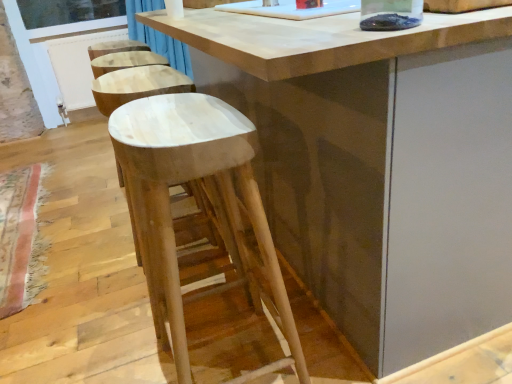
What do you see at coordinates (378, 165) in the screenshot?
I see `natural wood table at center` at bounding box center [378, 165].

The height and width of the screenshot is (384, 512). Identify the location of white plastic screen door at left. (63, 53).

You are a GUI agent. You are given a task and a screenshot of the screen. Output one action in this format:
    pyautogui.click(x=<x>, y=<y>)
    Task: Click on the natural wood table at center
    This screenshot has height=384, width=512.
    Given the screenshot: What is the action you would take?
    pyautogui.click(x=378, y=165)

Does natural wood stool at center have a smaller size compared to natural wood table at center?

Yes, natural wood stool at center is smaller than natural wood table at center.

Is natural wood stool at center turned away from natural wood table at center?

No.

Is natural wood table at center surrounded by natural wood stool at center?

Actually, natural wood table at center is outside natural wood stool at center.

Are natural wood stool at center and natural wood table at center located far from each other?

Actually, natural wood stool at center and natural wood table at center are a little close together.

From the image's perspective, between clear glass window screen at upper left and natural wood table at center, who is located below?

From the image's view, natural wood table at center is below.

Is clear glass window screen at upper left facing away from natural wood table at center?

clear glass window screen at upper left is not turned away from natural wood table at center.

Can you see clear glass window screen at upper left touching natural wood table at center?

No, clear glass window screen at upper left is not next to natural wood table at center.

How far apart are clear glass window screen at upper left and natural wood table at center?

10.25 feet.

Which is behind, point (33, 28) or point (26, 25)?

The point (26, 25) is farther from the camera.

Is clear glass window screen at upper left outside of white plastic screen door at left?

No, clear glass window screen at upper left is not entirely external to white plastic screen door at left.

Looking at their sizes, would you say clear glass window screen at upper left is wider or thinner than white plastic screen door at left?

clear glass window screen at upper left is thinner than white plastic screen door at left.

Is clear glass window screen at upper left looking in the opposite direction of white plastic screen door at left?

Yes, clear glass window screen at upper left's orientation is away from white plastic screen door at left.

From a real-world perspective, is natural wood table at center on white plastic screen door at left?

No, from a real-world perspective, natural wood table at center is not on top of white plastic screen door at left.

In the scene shown: Could you tell me if natural wood table at center is facing white plastic screen door at left?

No, natural wood table at center does not turn towards white plastic screen door at left.

In terms of size, does natural wood table at center appear bigger or smaller than white plastic screen door at left?

In the image, natural wood table at center appears to be larger than white plastic screen door at left.

Considering the sizes of objects natural wood table at center and white plastic screen door at left in the image provided, who is thinner, natural wood table at center or white plastic screen door at left?

white plastic screen door at left.

Could you tell me if natural wood stool at center is turned towards white plastic screen door at left?

No, natural wood stool at center is not oriented towards white plastic screen door at left.

Can we say natural wood stool at center lies outside white plastic screen door at left?

Yes, natural wood stool at center is outside of white plastic screen door at left.

This screenshot has height=384, width=512. I want to click on screen door located behind the natural wood stool at center, so click(x=63, y=53).

Can you confirm if natural wood stool at center is bigger than white plastic screen door at left?

Correct, natural wood stool at center is larger in size than white plastic screen door at left.

Is natural wood stool at center surrounded by white plastic screen door at left?

No, natural wood stool at center is not inside white plastic screen door at left.

From a real-world perspective, which object stands above the other?

white plastic screen door at left is physically above.

Considering their positions, is white plastic screen door at left located in front of or behind natural wood stool at center?

white plastic screen door at left is positioned farther from the viewer than natural wood stool at center.

Does white plastic screen door at left have a lesser width compared to natural wood stool at center?

Yes.

Considering their positions, is natural wood stool at center located in front of or behind clear glass window screen at upper left?

Visually, natural wood stool at center is located in front of clear glass window screen at upper left.

Which of these two, natural wood stool at center or clear glass window screen at upper left, stands shorter?

clear glass window screen at upper left is shorter.

Is natural wood stool at center wider than clear glass window screen at upper left?

Indeed, natural wood stool at center has a greater width compared to clear glass window screen at upper left.

From a real-world perspective, which object rests below the other?

natural wood stool at center is physically lower.

You are a GUI agent. You are given a task and a screenshot of the screen. Output one action in this format:
    pyautogui.click(x=<x>, y=<y>)
    Task: Click on the table behind the natural wood stool at center
    The image size is (512, 384).
    Given the screenshot: What is the action you would take?
    pyautogui.click(x=378, y=165)

At what (x,y) coordinates should I click in order to perform the action: click on table below the clear glass window screen at upper left (from a real-world perspective). Please return your answer as a coordinate pair (x, y). Looking at the image, I should click on (378, 165).

Based on the photo, based on their spatial positions, is clear glass window screen at upper left or natural wood table at center further from white plastic screen door at left?

natural wood table at center is positioned further to the anchor white plastic screen door at left.

Based on their spatial positions, is natural wood table at center or natural wood stool at center closer to white plastic screen door at left?

natural wood table at center is positioned closer to the anchor white plastic screen door at left.

From the image, which object appears to be farther from natural wood stool at center, clear glass window screen at upper left or natural wood table at center?

Based on the image, clear glass window screen at upper left appears to be further to natural wood stool at center.

Estimate the real-world distances between objects in this image. Which object is further from white plastic screen door at left, natural wood stool at center or natural wood table at center?

natural wood stool at center is positioned further to the anchor white plastic screen door at left.

From the image, which object appears to be farther from natural wood stool at center, clear glass window screen at upper left or white plastic screen door at left?

clear glass window screen at upper left lies further to natural wood stool at center than the other object.

Which object lies further to the anchor point natural wood table at center, white plastic screen door at left or natural wood stool at center?

white plastic screen door at left.

Looking at the image, which one is located closer to clear glass window screen at upper left, white plastic screen door at left or natural wood table at center?

Among the two, white plastic screen door at left is located nearer to clear glass window screen at upper left.

Estimate the real-world distances between objects in this image. Which object is closer to white plastic screen door at left, natural wood table at center or clear glass window screen at upper left?

Based on the image, clear glass window screen at upper left appears to be nearer to white plastic screen door at left.

In order to click on screen door positioned between natural wood stool at center and clear glass window screen at upper left from near to far in this screenshot , I will do `click(63, 53)`.

Identify the location of table between natural wood stool at center and white plastic screen door at left from front to back. The width and height of the screenshot is (512, 384). (378, 165).

The height and width of the screenshot is (384, 512). Identify the location of table located between natural wood stool at center and clear glass window screen at upper left in the depth direction. (378, 165).

At what (x,y) coordinates should I click in order to perform the action: click on screen door between natural wood table at center and clear glass window screen at upper left in the front-back direction. Please return your answer as a coordinate pair (x, y). Looking at the image, I should click on (63, 53).